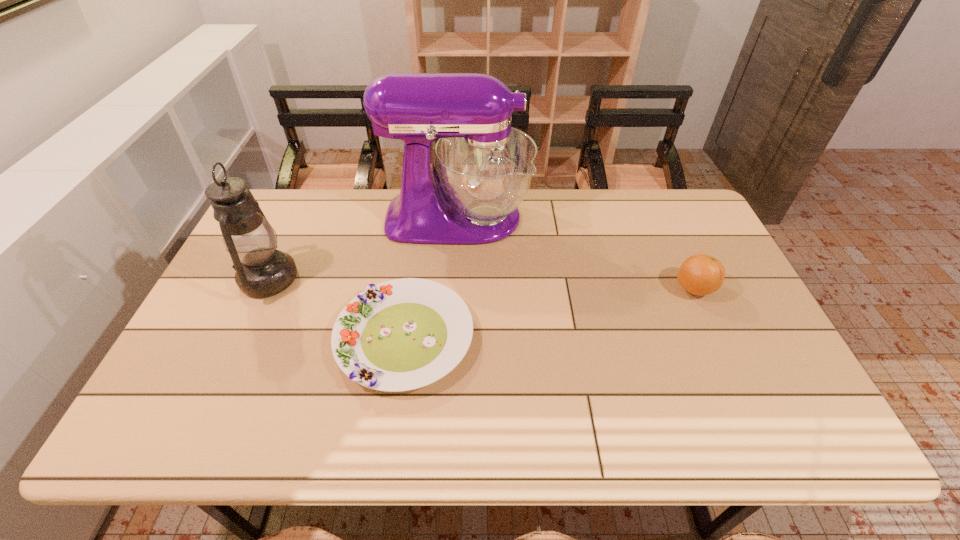
The width and height of the screenshot is (960, 540). In order to click on vacant space positioned on the left of the salad plate in this screenshot , I will do `click(231, 338)`.

The width and height of the screenshot is (960, 540). I want to click on object situated at the far edge, so click(x=485, y=167).

I want to click on object that is at the left edge, so coord(262,271).

This screenshot has height=540, width=960. In order to click on object located in the right edge section of the desktop in this screenshot , I will do `click(700, 274)`.

I want to click on free space at the far edge of the desktop, so click(560, 226).

Locate an element on the screen. This screenshot has width=960, height=540. free spot at the near edge of the desktop is located at coordinates (214, 433).

What are the coordinates of `free space at the right edge of the desktop` in the screenshot? It's located at (791, 374).

In the image, there is a desktop. Identify the location of blank space at the far left corner. The width and height of the screenshot is (960, 540). (294, 225).

The width and height of the screenshot is (960, 540). In the image, there is a desktop. Find the location of `free space at the near right corner`. free space at the near right corner is located at coordinates (760, 410).

Locate an element on the screen. vacant space in between the salad plate and the tallest object is located at coordinates (431, 278).